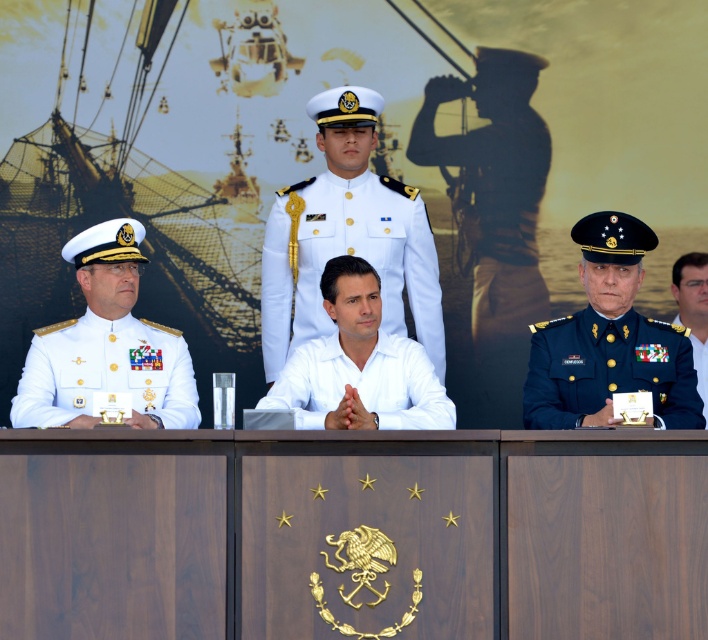
Is white matte uniform at left below dark green military uniform at right?

Correct, white matte uniform at left is located below dark green military uniform at right.

Consider the image. Does white matte uniform at left have a greater height compared to dark green military uniform at right?

Correct, white matte uniform at left is much taller as dark green military uniform at right.

At what (x,y) coordinates should I click in order to perform the action: click on white matte uniform at left. Please return your answer as a coordinate pair (x, y). Looking at the image, I should click on [x=105, y=371].

Can you confirm if white glossy uniform at center is wider than white matte uniform at left?

Yes, white glossy uniform at center is wider than white matte uniform at left.

Who is lower down, white glossy uniform at center or white matte uniform at left?

Positioned lower is white matte uniform at left.

Does point (371, 189) lie in front of point (84, 385)?

No.

This screenshot has height=640, width=708. In order to click on white glossy uniform at center in this screenshot , I will do `click(348, 253)`.

Which is behind, point (622, 369) or point (428, 422)?

Point (622, 369)

Can you confirm if dark green military uniform at right is bigger than white matte shirt at center?

No, dark green military uniform at right is not bigger than white matte shirt at center.

The width and height of the screenshot is (708, 640). What do you see at coordinates (607, 369) in the screenshot? I see `dark green military uniform at right` at bounding box center [607, 369].

At what (x,y) coordinates should I click in order to perform the action: click on dark green military uniform at right. Please return your answer as a coordinate pair (x, y). This screenshot has height=640, width=708. Looking at the image, I should click on (607, 369).